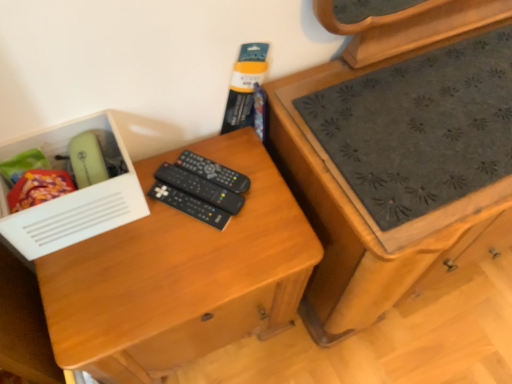
Where is `free spot in front of black plastic remote controls at center, the second remote control positioned from the bottom`? free spot in front of black plastic remote controls at center, the second remote control positioned from the bottom is located at coordinates (180, 264).